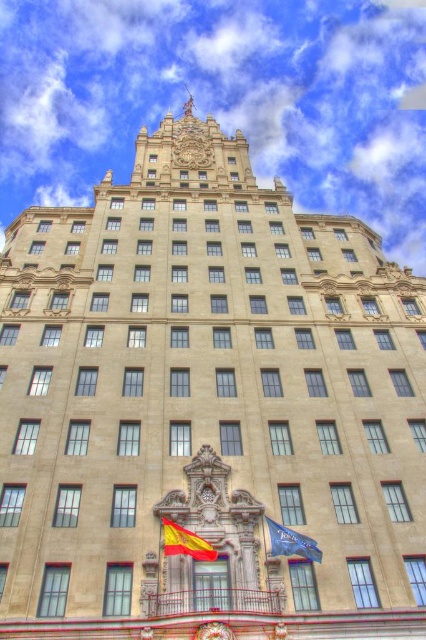
Who is shorter, red fabric flag at center or blue fabric flag at center?

blue fabric flag at center

Can you confirm if red fabric flag at center is positioned below blue fabric flag at center?

Yes, red fabric flag at center is below blue fabric flag at center.

Is point (186, 545) closer to camera compared to point (305, 557)?

No, (186, 545) is behind (305, 557).

Image resolution: width=426 pixels, height=640 pixels. Identify the location of red fabric flag at center. (184, 541).